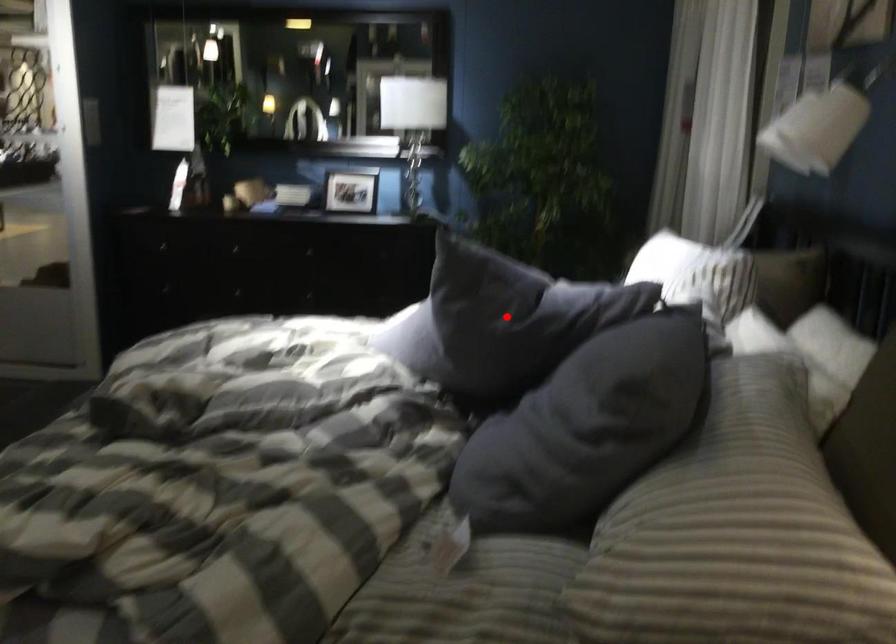
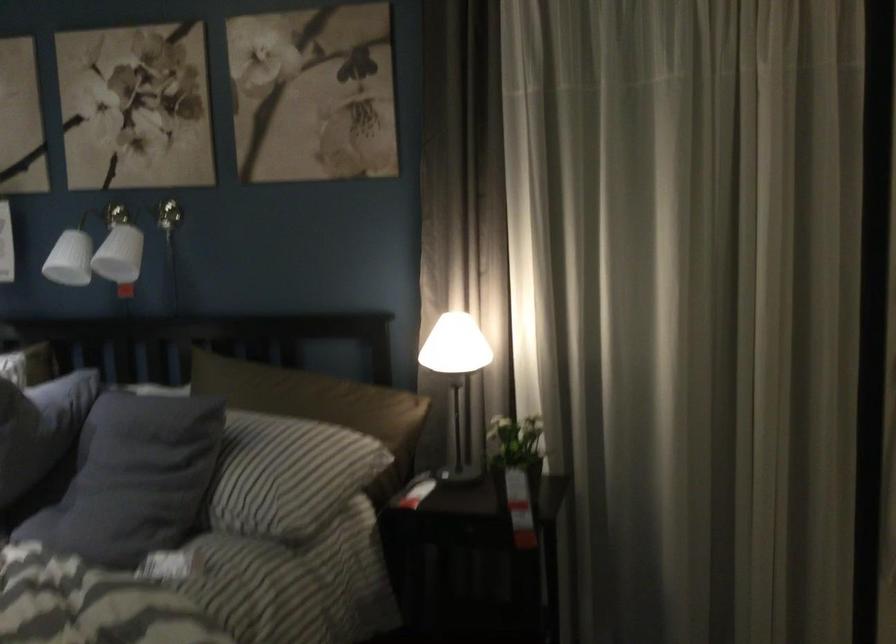
Where in the second image is the point corresponding to the highlighted location from the first image?

(39, 428)